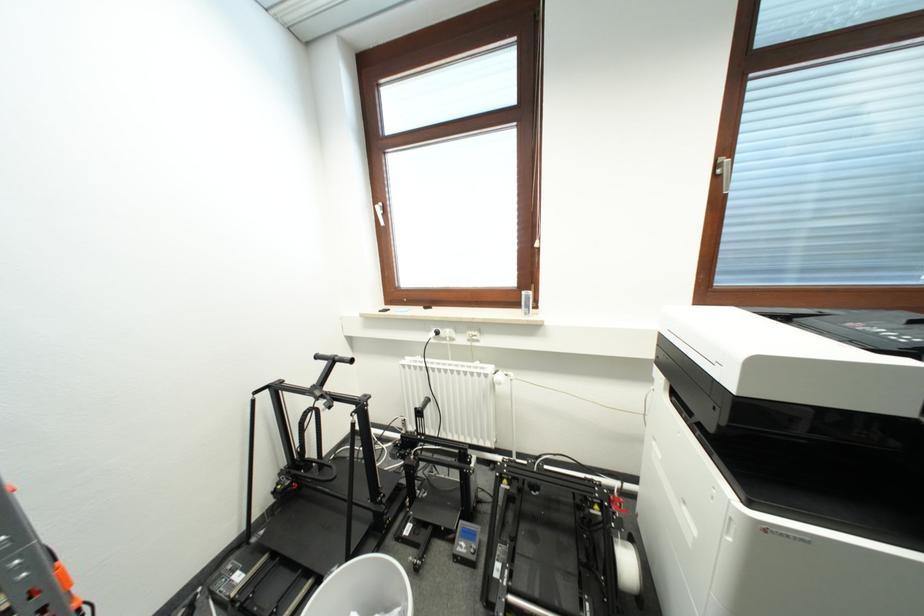
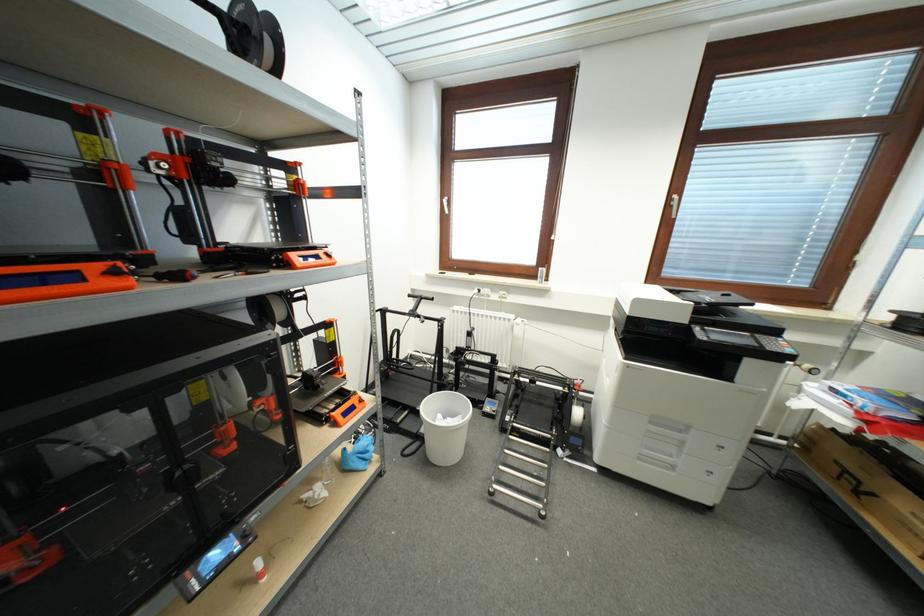
Find the pixel in the second image that matches the point at 379,206 in the first image.

(446, 200)